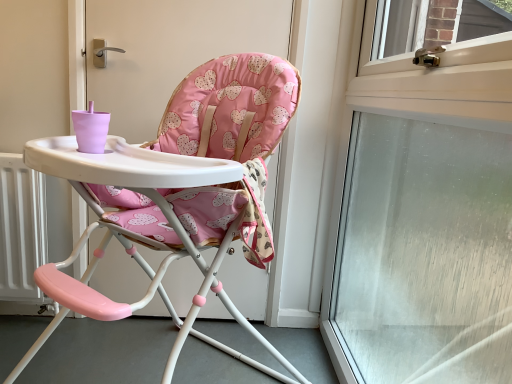
Question: Is point (497, 258) closer or farther from the camera than point (64, 155)?

Choices:
 (A) closer
 (B) farther

Answer: (B)

Question: Is transparent glass window at upper right bigger or smaller than pink fabric highchair at center?

Choices:
 (A) big
 (B) small

Answer: (B)

Question: Is transparent glass window at upper right taller or shorter than pink fabric highchair at center?

Choices:
 (A) tall
 (B) short

Answer: (A)

Question: Considering their positions, is pink fabric highchair at center located in front of or behind transparent glass window at upper right?

Choices:
 (A) behind
 (B) front

Answer: (A)

Question: Does point (276, 115) appear closer or farther from the camera than point (501, 369)?

Choices:
 (A) closer
 (B) farther

Answer: (A)

Question: From the image's perspective, is pink fabric highchair at center above or below transparent glass window at upper right?

Choices:
 (A) above
 (B) below

Answer: (B)

Question: From a real-world perspective, relative to transparent glass window at upper right, is pink fabric highchair at center vertically above or below?

Choices:
 (A) below
 (B) above

Answer: (A)